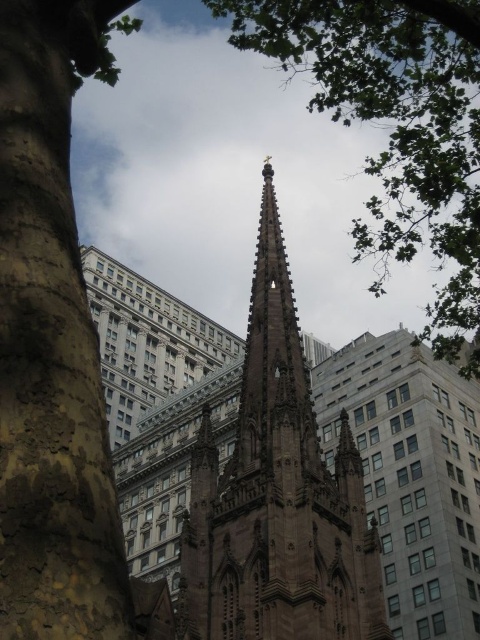
You are an architect evaluating the height of the brown stone spire at center and the green leafy tree at upper center in the image. Which one is shorter?

The brown stone spire at center is not as tall as the green leafy tree at upper center, so the brown stone spire at center is shorter.

You are standing at a point where you can see the Gothic church spire and the modern buildings around it. If you want to take a photo that includes both the spire and the closest modern building, which direction should you move to ensure both are in frame? Please consider the distance between you and the point at coordinates (251, 376).

Since the point at coordinates (251, 376) is 69.45 meters away from you, you should move closer to that point to ensure both the Gothic church spire and the nearest modern buildings are within your camera frame.

You are a city planner assessing green spaces in the area. You notice the brown rough bark at left and the green leafy tree at upper center in the scene. Which of these two has a larger size?

The green leafy tree at upper center is larger than the brown rough bark at left.